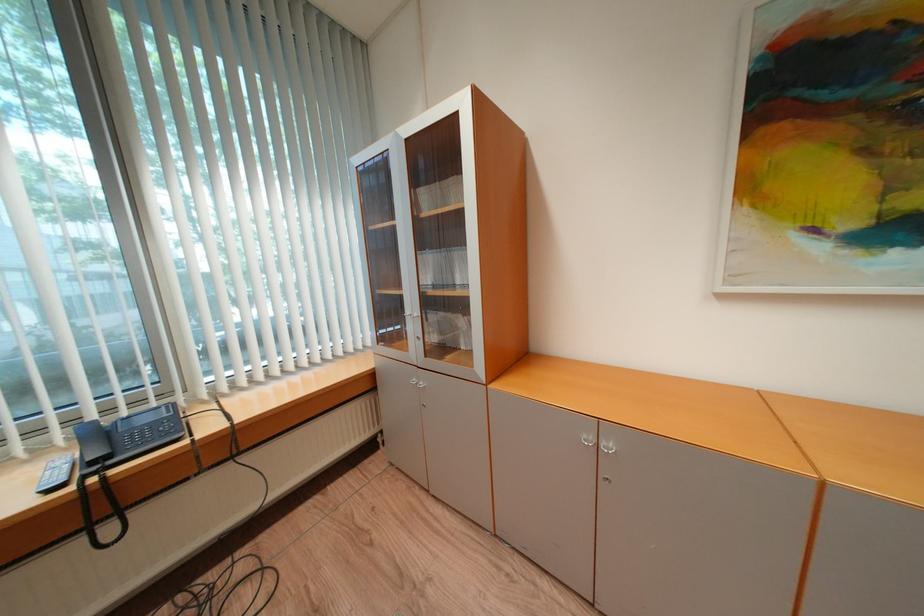
Where would you press the telephone keypad buttons? Please return your answer as a coordinate pair (x, y).

(141, 435)